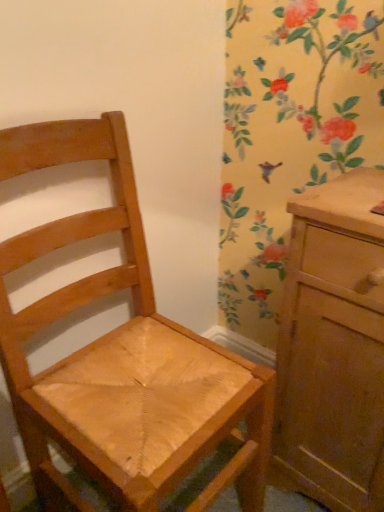
Question: Does matte wood chest of drawers at right have a greater width compared to wooden chair at center?

Choices:
 (A) no
 (B) yes

Answer: (A)

Question: Considering the relative sizes of matte wood chest of drawers at right and wooden chair at center in the image provided, is matte wood chest of drawers at right shorter than wooden chair at center?

Choices:
 (A) no
 (B) yes

Answer: (B)

Question: Does matte wood chest of drawers at right have a smaller size compared to wooden chair at center?

Choices:
 (A) yes
 (B) no

Answer: (A)

Question: Considering the relative sizes of matte wood chest of drawers at right and wooden chair at center in the image provided, is matte wood chest of drawers at right bigger than wooden chair at center?

Choices:
 (A) no
 (B) yes

Answer: (A)

Question: Is matte wood chest of drawers at right taller than wooden chair at center?

Choices:
 (A) no
 (B) yes

Answer: (A)

Question: Would you say wooden chair at center is part of matte wood chest of drawers at right's contents?

Choices:
 (A) yes
 (B) no

Answer: (B)

Question: From a real-world perspective, does wooden chair at center stand above matte wood chest of drawers at right?

Choices:
 (A) yes
 (B) no

Answer: (A)

Question: Is wooden chair at center far from matte wood chest of drawers at right?

Choices:
 (A) no
 (B) yes

Answer: (A)

Question: Does wooden chair at center contain matte wood chest of drawers at right?

Choices:
 (A) no
 (B) yes

Answer: (A)

Question: Considering the relative sizes of wooden chair at center and matte wood chest of drawers at right in the image provided, is wooden chair at center wider than matte wood chest of drawers at right?

Choices:
 (A) no
 (B) yes

Answer: (B)

Question: Does wooden chair at center turn towards matte wood chest of drawers at right?

Choices:
 (A) yes
 (B) no

Answer: (B)

Question: From the image's perspective, is wooden chair at center beneath matte wood chest of drawers at right?

Choices:
 (A) no
 (B) yes

Answer: (A)

Question: Relative to wooden chair at center, is matte wood chest of drawers at right in front or behind?

Choices:
 (A) front
 (B) behind

Answer: (B)